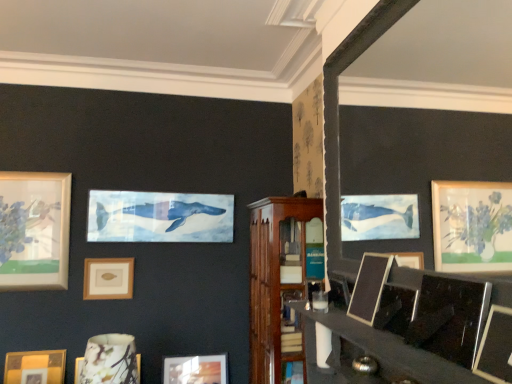
Question: Is matte gold picture frame at center-left, which is counted as the 1th picture frame, starting from the back, to the left of matte ceramic vase at lower left, arranged as the 5th picture frame when viewed from the right, from the viewer's perspective?

Choices:
 (A) no
 (B) yes

Answer: (B)

Question: From a real-world perspective, does matte gold picture frame at center-left, which appears as the 2th picture frame when viewed from the left, stand above matte ceramic vase at lower left, arranged as the 5th picture frame when viewed from the right?

Choices:
 (A) yes
 (B) no

Answer: (A)

Question: Is the position of matte gold picture frame at center-left, which appears as the 2th picture frame when viewed from the left, more distant than that of matte ceramic vase at lower left, the fifth picture frame viewed from the front?

Choices:
 (A) no
 (B) yes

Answer: (B)

Question: Is the position of matte gold picture frame at center-left, which is counted as the 1th picture frame, starting from the back, less distant than that of matte ceramic vase at lower left, acting as the third picture frame starting from the left?

Choices:
 (A) yes
 (B) no

Answer: (B)

Question: From the image's perspective, is matte gold picture frame at center-left, acting as the 7th picture frame starting from the front, beneath matte ceramic vase at lower left, arranged as the 3th picture frame when viewed from the back?

Choices:
 (A) yes
 (B) no

Answer: (B)

Question: Would you say matte gold picture frame at lower left, which ranks as the 4th picture frame in front-to-back order, is inside or outside matte wooden picture frame at lower center, marked as the fourth picture frame in a left-to-right arrangement?

Choices:
 (A) outside
 (B) inside

Answer: (A)

Question: Is matte gold picture frame at lower left, which ranks as the fourth picture frame in back-to-front order, wider or thinner than matte wooden picture frame at lower center, marked as the fourth picture frame in a left-to-right arrangement?

Choices:
 (A) thin
 (B) wide

Answer: (A)

Question: From a real-world perspective, is matte gold picture frame at lower left, which ranks as the fourth picture frame in back-to-front order, physically located above or below matte wooden picture frame at lower center, marked as the fourth picture frame in a left-to-right arrangement?

Choices:
 (A) below
 (B) above

Answer: (B)

Question: From the image's perspective, is matte gold picture frame at lower left, which ranks as the 4th picture frame in front-to-back order, positioned above or below matte wooden picture frame at lower center, the sixth picture frame in the front-to-back sequence?

Choices:
 (A) above
 (B) below

Answer: (A)

Question: From their relative heights in the image, would you say wooden cabinet at center is taller or shorter than matte gold picture frame at center-left, which is counted as the 1th picture frame, starting from the back?

Choices:
 (A) short
 (B) tall

Answer: (B)

Question: Considering the positions of wooden cabinet at center and matte gold picture frame at center-left, which is counted as the 1th picture frame, starting from the back, in the image, is wooden cabinet at center wider or thinner than matte gold picture frame at center-left, which is counted as the 1th picture frame, starting from the back,?

Choices:
 (A) wide
 (B) thin

Answer: (A)

Question: From the image's perspective, is wooden cabinet at center above or below matte gold picture frame at center-left, the 6th picture frame in the right-to-left sequence?

Choices:
 (A) below
 (B) above

Answer: (A)

Question: Relative to matte gold picture frame at center-left, which is counted as the 1th picture frame, starting from the back, is wooden cabinet at center in front or behind?

Choices:
 (A) front
 (B) behind

Answer: (A)

Question: From a real-world perspective, is matte ceramic vase at lower left, acting as the third picture frame starting from the left, positioned above or below wooden picture frame at center, arranged as the fifth picture frame when viewed from the back?

Choices:
 (A) above
 (B) below

Answer: (B)

Question: Is point (80, 369) closer or farther from the camera than point (364, 301)?

Choices:
 (A) closer
 (B) farther

Answer: (B)